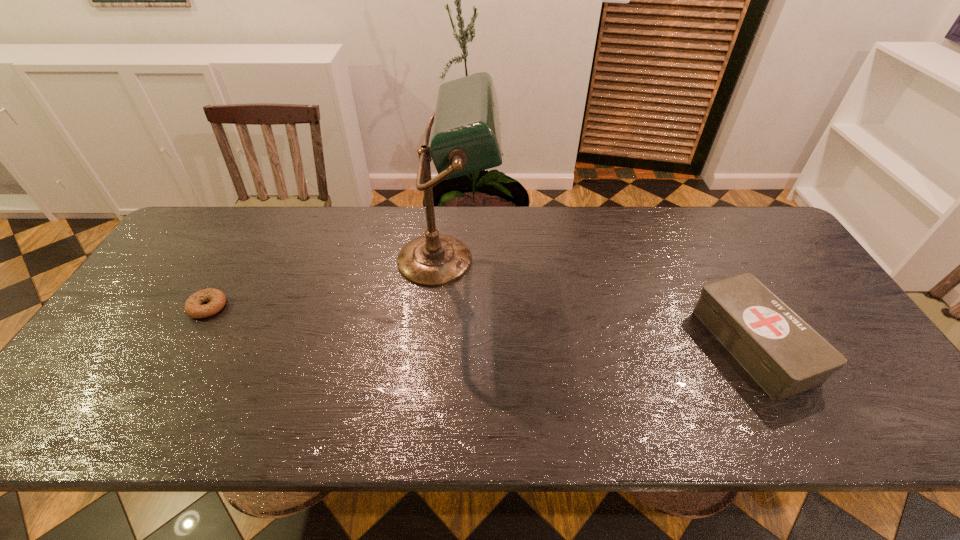
The width and height of the screenshot is (960, 540). In order to click on table lamp in this screenshot , I will do `click(466, 138)`.

Locate an element on the screen. The image size is (960, 540). the second object from left to right is located at coordinates (466, 138).

You are a GUI agent. You are given a task and a screenshot of the screen. Output one action in this format:
    pyautogui.click(x=<x>, y=<y>)
    Task: Click on the rightmost object
    
    Given the screenshot: What is the action you would take?
    pyautogui.click(x=783, y=354)

This screenshot has width=960, height=540. I want to click on the second tallest object, so click(783, 354).

Identify the location of the leftmost object. (216, 299).

Identify the location of bagel. The height and width of the screenshot is (540, 960). (216, 299).

Locate an element on the screen. This screenshot has height=540, width=960. vacant space located 0.100m above the green lampshade of the table lamp is located at coordinates (529, 260).

Image resolution: width=960 pixels, height=540 pixels. I want to click on vacant space located on the right of the second tallest object, so click(821, 345).

What are the coordinates of `blank area located 0.100m on the right of the shortest object` in the screenshot? It's located at (263, 306).

Locate an element on the screen. object situated at the far edge is located at coordinates (466, 138).